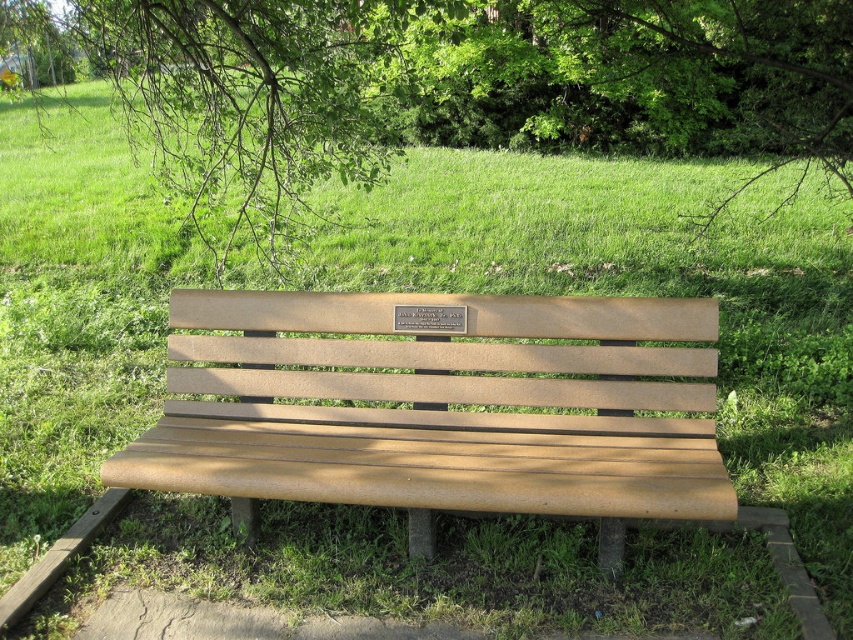
You are a gardener who wants to place a new flower pot between the green leafy tree at upper center and the bronze plaque at center. Based on their positions, which object should the flower pot be closer to?

The green leafy tree at upper center is positioned over the bronze plaque at center, so the flower pot should be placed closer to the bronze plaque at center to avoid being under the tree.

You are standing at the point marked by the coordinates point (x=457, y=86) in the park. What object is exactly at this location?

The green leafy tree at upper center is located at point (x=457, y=86).

What are the coordinates of the green leafy tree at upper center in the image?

The green leafy tree at upper center is located at coordinates (457,86).